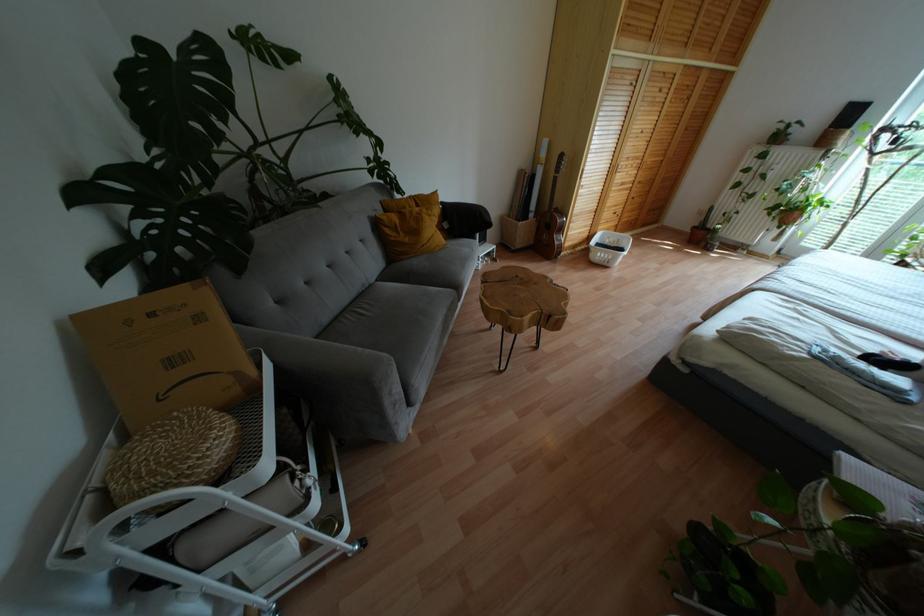
The location [551,220] corresponds to which object?

It corresponds to the brown guitar in the image.